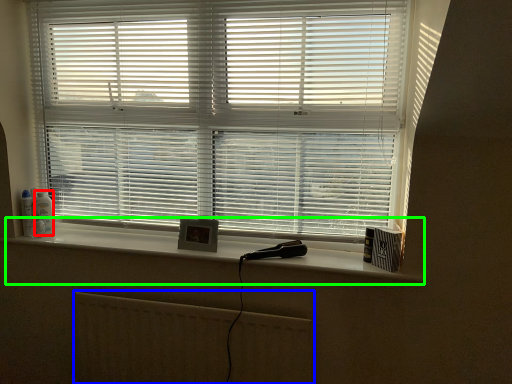
Question: Estimate the real-world distances between objects in this image. Which object is farther from toiletry (highlighted by a red box), radiator (highlighted by a blue box) or window sill (highlighted by a green box)?

Choices:
 (A) radiator
 (B) window sill

Answer: (A)